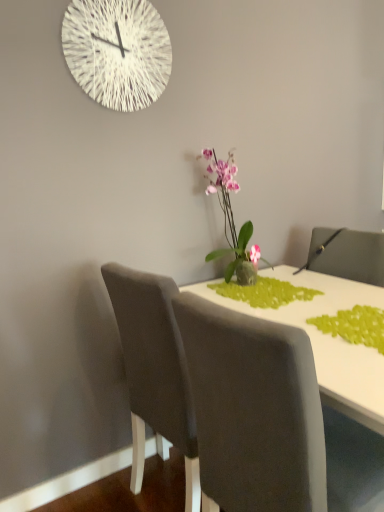
Question: Considering the relative sizes of green matte plant at center, acting as the second plant starting from the front, and pink glossy orchid at center in the image provided, is green matte plant at center, acting as the second plant starting from the front, bigger than pink glossy orchid at center?

Choices:
 (A) yes
 (B) no

Answer: (B)

Question: Is the position of green matte plant at center, acting as the second plant starting from the front, more distant than that of pink glossy orchid at center?

Choices:
 (A) no
 (B) yes

Answer: (A)

Question: From the image's perspective, is green matte plant at center, which appears as the 1th plant when viewed from the back, on pink glossy orchid at center?

Choices:
 (A) no
 (B) yes

Answer: (A)

Question: Is pink glossy orchid at center surrounded by green matte plant at center, which appears as the 1th plant when viewed from the back?

Choices:
 (A) no
 (B) yes

Answer: (A)

Question: Considering the relative sizes of green matte plant at center, which appears as the 1th plant when viewed from the back, and pink glossy orchid at center in the image provided, is green matte plant at center, which appears as the 1th plant when viewed from the back, taller than pink glossy orchid at center?

Choices:
 (A) yes
 (B) no

Answer: (B)

Question: Considering the relative sizes of green matte plant at center, acting as the second plant starting from the front, and pink glossy orchid at center in the image provided, is green matte plant at center, acting as the second plant starting from the front, smaller than pink glossy orchid at center?

Choices:
 (A) no
 (B) yes

Answer: (B)

Question: Is white string clock at upper center at the right side of pink glossy orchid at center?

Choices:
 (A) no
 (B) yes

Answer: (A)

Question: Does white string clock at upper center have a smaller size compared to pink glossy orchid at center?

Choices:
 (A) no
 (B) yes

Answer: (B)

Question: Is white string clock at upper center positioned with its back to pink glossy orchid at center?

Choices:
 (A) yes
 (B) no

Answer: (B)

Question: Is white string clock at upper center next to pink glossy orchid at center and touching it?

Choices:
 (A) yes
 (B) no

Answer: (B)

Question: From the image's perspective, is white string clock at upper center over pink glossy orchid at center?

Choices:
 (A) no
 (B) yes

Answer: (B)

Question: Is white string clock at upper center outside of pink glossy orchid at center?

Choices:
 (A) yes
 (B) no

Answer: (A)

Question: Is white string clock at upper center further to the viewer compared to white glossy table at center?

Choices:
 (A) no
 (B) yes

Answer: (B)